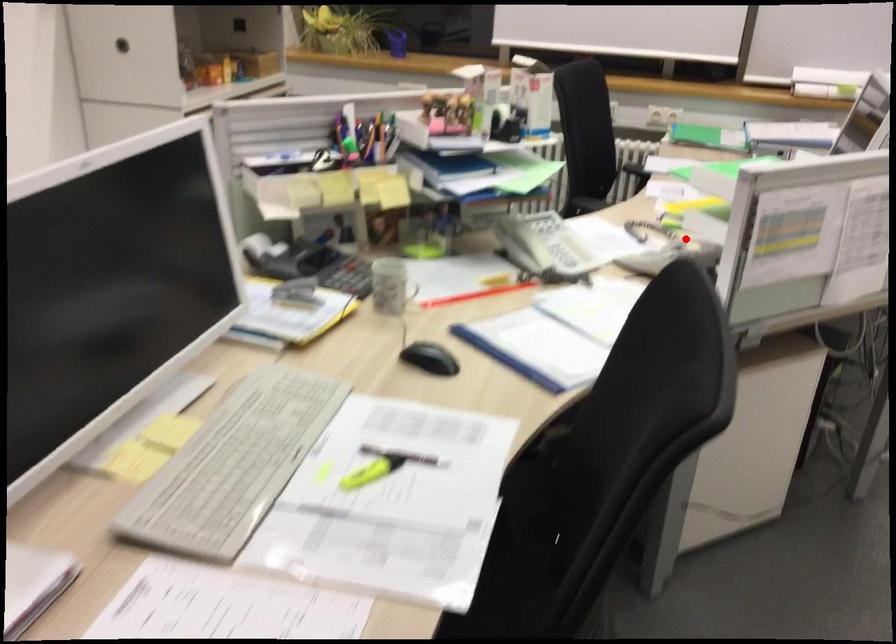
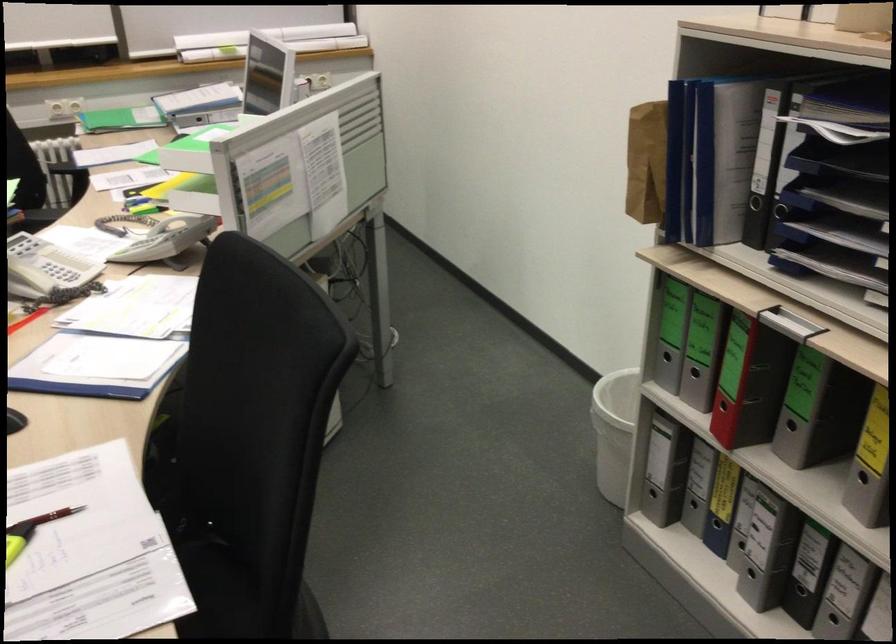
The point at the highlighted location is marked in the first image. Where is the corresponding point in the second image?

(179, 223)